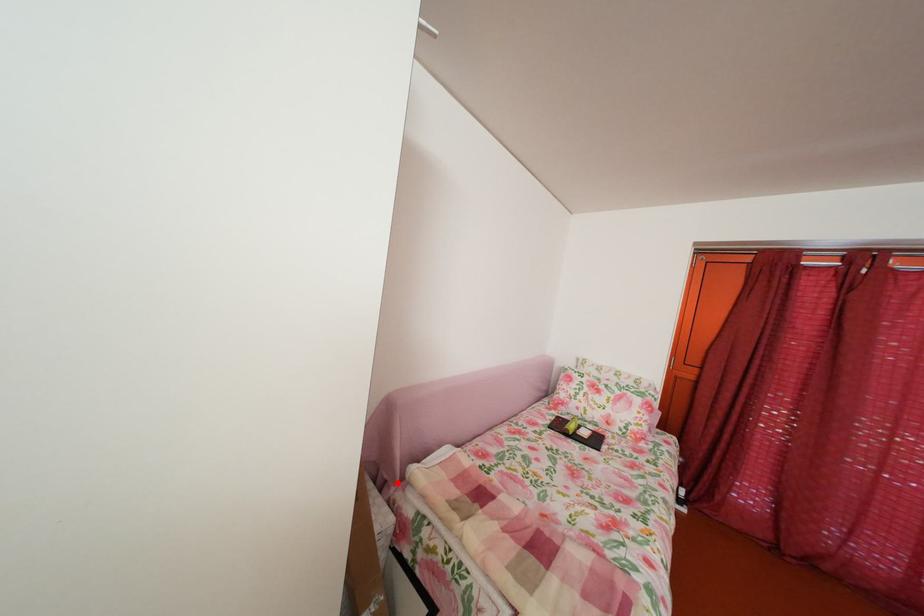
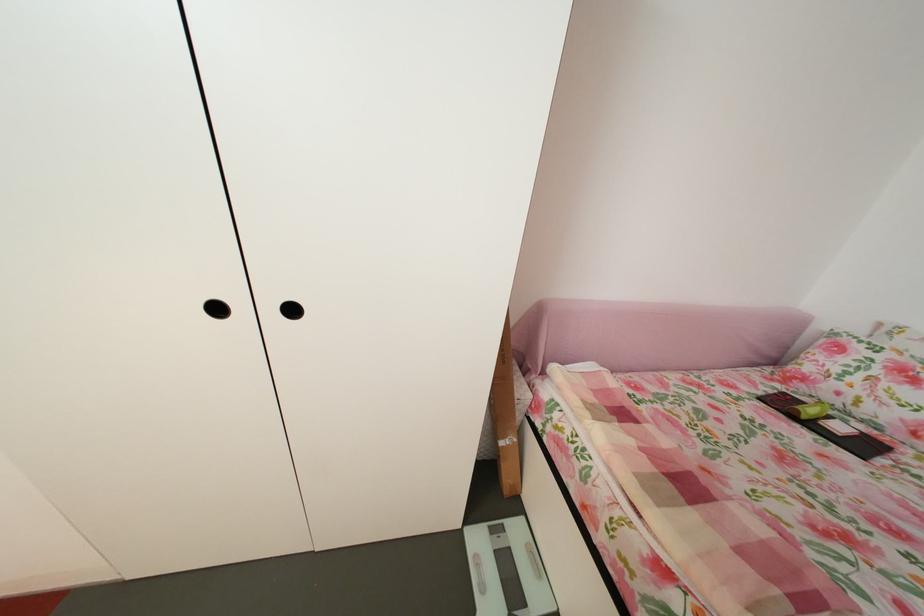
The point at the highlighted location is marked in the first image. Where is the corresponding point in the second image?

(541, 371)